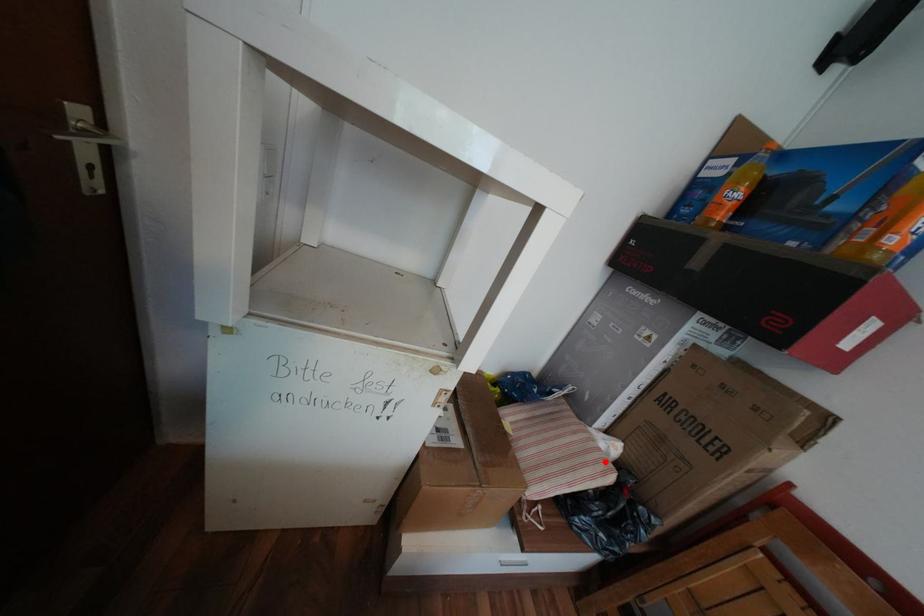
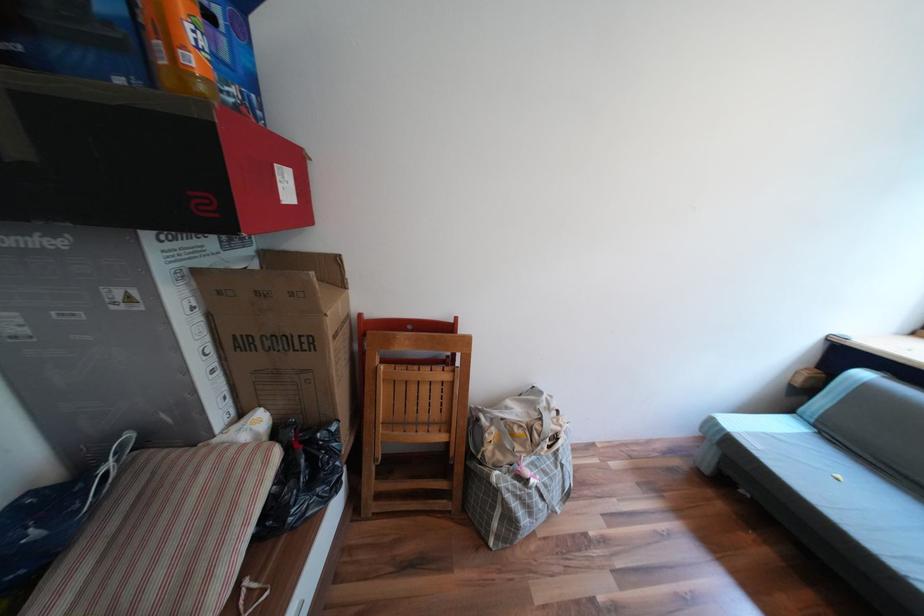
Find the pixel in the second image that matches the highlighted location in the first image.

(258, 464)